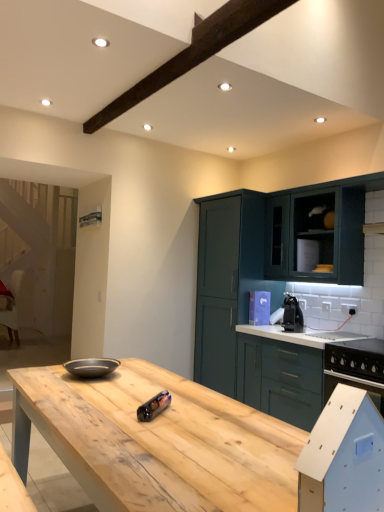
Locate an element on the screen. This screenshot has height=512, width=384. free space to the left of black plastic coffee machine at center, the 1th appliance positioned from the right is located at coordinates (278, 329).